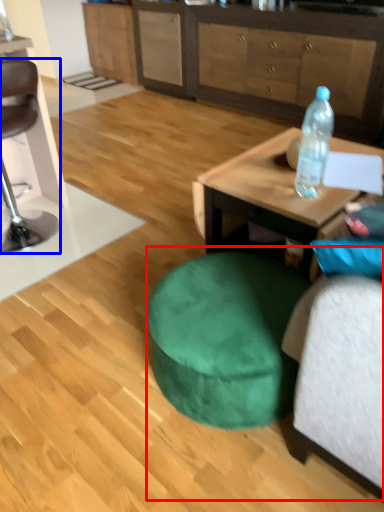
Question: Which object appears closest to the camera in this image, bean bag chair (highlighted by a red box) or chair (highlighted by a blue box)?

Choices:
 (A) bean bag chair
 (B) chair

Answer: (A)